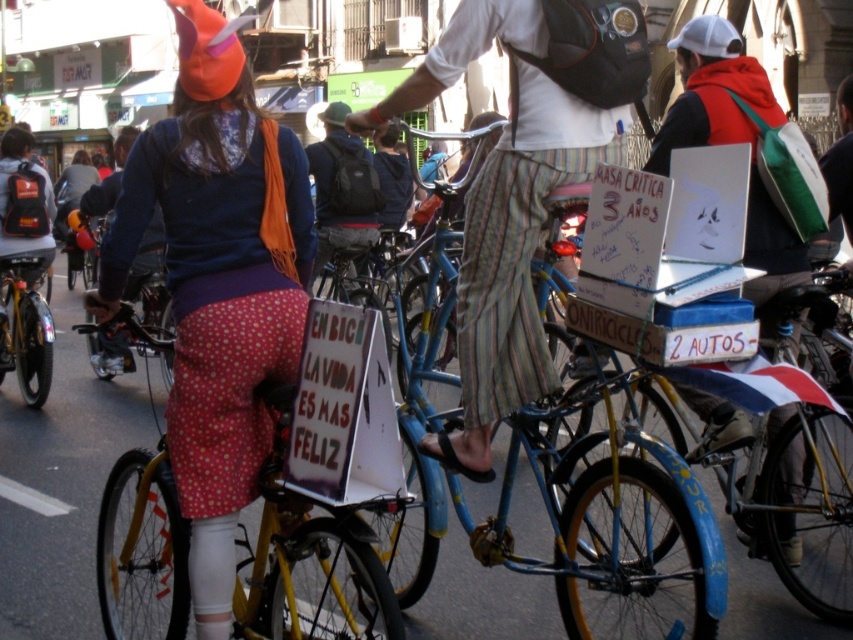
You are standing at the starting point of a bicycle race and see two points marked on the map. The first point is at coordinate point [712,96] and the second is at point [48,380]. Which point is closer to the starting line?

Point [712,96] is in front of point [48,380], so the first point is closer to the starting line.

You are a pedestrian trying to cross the street and see the dark gray backpack at center and the shiny metallic bicycle at left. Which object is closer to your left side?

The shiny metallic bicycle at left is closer to your left side because it is positioned to the left of the dark gray backpack at center.